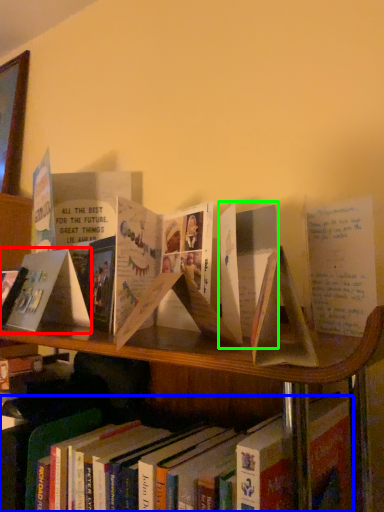
Question: Considering the real-world distances, which object is farthest from paperback book (highlighted by a red box)? book (highlighted by a blue box) or paperback book (highlighted by a green box)?

Choices:
 (A) book
 (B) paperback book

Answer: (B)